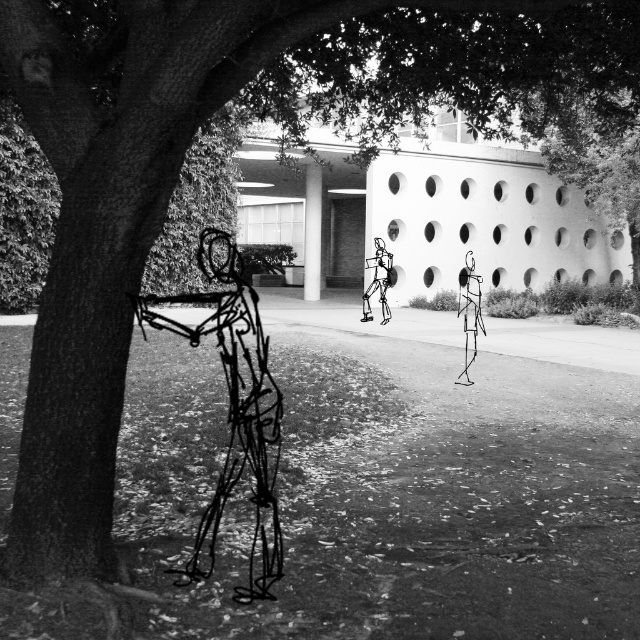
You are an architect evaluating the space between two wireframe figures in the image. The wireframe figure at left and the wireframe figure at center are both part of a proposed design. If you need to place a 1.5 meter wide sculpture between them, can the space accommodate it?

The wireframe figure at left might be wider than wireframe figure at center, so the space between them could potentially accommodate a 1.5 meter wide sculpture depending on their exact dimensions.

You are an architect analyzing the spatial arrangement of the scene. You observe the wireframe figure at left and the wireframe figure at center. Which wireframe figure is taller?

The wireframe figure at left is taller than the wireframe figure at center.